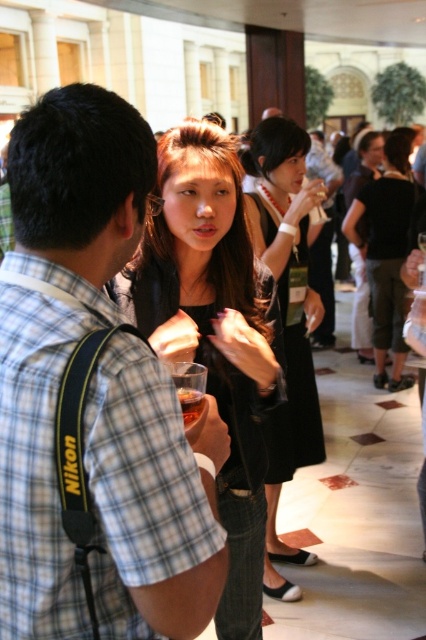
Question: Observing the image, what is the correct spatial positioning of plaid cotton shirt at center in reference to black leather jacket at center?

Choices:
 (A) above
 (B) below

Answer: (B)

Question: Which point is closer to the camera?

Choices:
 (A) black leather jacket at center
 (B) plaid cotton shirt at center
 (C) translucent plastic cup at center

Answer: (B)

Question: Which object is the farthest from the black dress at center?

Choices:
 (A) plaid cotton shirt at center
 (B) translucent plastic cup at center
 (C) matte black jacket at center

Answer: (A)

Question: Does plaid cotton shirt at center appear on the left side of black dress at center?

Choices:
 (A) yes
 (B) no

Answer: (A)

Question: Which point is farther to the camera?

Choices:
 (A) translucent plastic cup at center
 (B) black leather jacket at center

Answer: (B)

Question: Does black dress at center come behind translucent plastic cup at center?

Choices:
 (A) yes
 (B) no

Answer: (A)